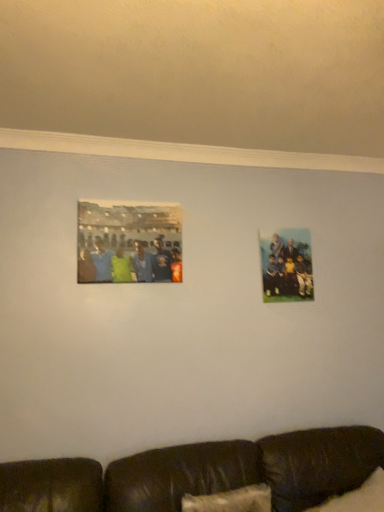
Question: Is white fluffy pillow at lower right in front of or behind matte plastic photo frame at right, which is counted as the 2th picture frame, starting from the front, in the image?

Choices:
 (A) behind
 (B) front

Answer: (B)

Question: In terms of height, does white fluffy pillow at lower right look taller or shorter compared to matte plastic photo frame at right, the first picture frame from the back?

Choices:
 (A) tall
 (B) short

Answer: (B)

Question: Which is farther from the white fluffy pillow at lower right?

Choices:
 (A) matte plastic photo frame at upper left, placed as the 1th picture frame when sorted from left to right
 (B) matte plastic photo frame at right, the second picture frame viewed from the left
 (C) brown leather couch at lower center

Answer: (A)

Question: Which object is positioned closest to the matte plastic photo frame at upper left, the first picture frame positioned from the front?

Choices:
 (A) white fluffy pillow at lower right
 (B) brown leather couch at lower center
 (C) matte plastic photo frame at right, acting as the 1th picture frame starting from the right

Answer: (C)